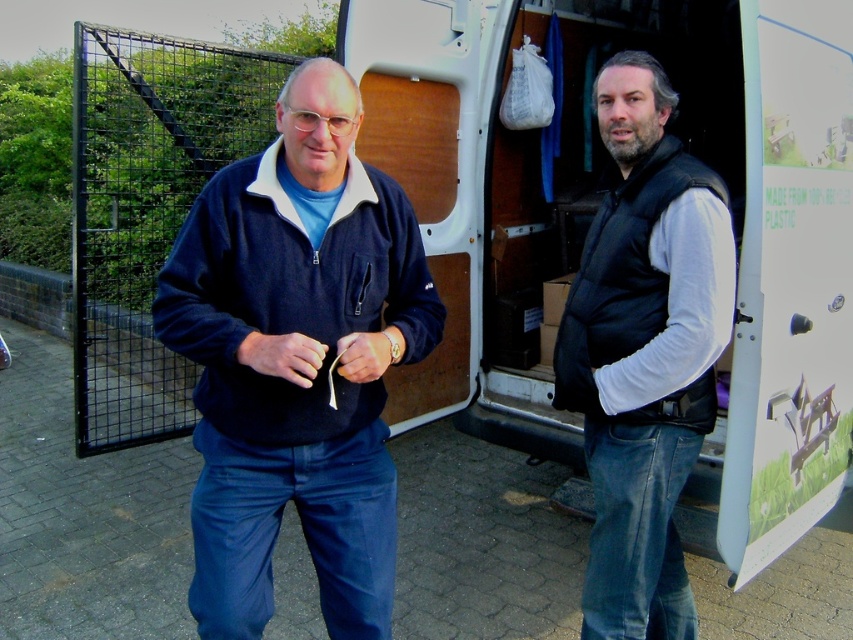
At what (x,y) coordinates should I click in order to perform the action: click on white plastic van at center. Please return your answer as a coordinate pair (x, y). Image resolution: width=853 pixels, height=640 pixels. Looking at the image, I should click on (593, 211).

Is white plastic van at center to the right of navy fleece jacket at center from the viewer's perspective?

Yes, white plastic van at center is to the right of navy fleece jacket at center.

Which is in front, point (759, 253) or point (347, 464)?

Point (759, 253) is in front.

Find the location of a particular element. Image resolution: width=853 pixels, height=640 pixels. white plastic van at center is located at coordinates (593, 211).

Is navy fleece jacket at center taller than black matte vest at center?

Incorrect, navy fleece jacket at center's height is not larger of black matte vest at center's.

Is point (329, 554) positioned in front of point (616, 332)?

That is True.

Locate an element on the screen. The height and width of the screenshot is (640, 853). navy fleece jacket at center is located at coordinates (297, 362).

Locate an element on the screen. The image size is (853, 640). navy fleece jacket at center is located at coordinates (297, 362).

Can you confirm if white plastic van at center is taller than black matte vest at center?

Correct, white plastic van at center is much taller as black matte vest at center.

Measure the distance from white plastic van at center to black matte vest at center.

The distance of white plastic van at center from black matte vest at center is 1.22 meters.

Describe the element at coordinates (593, 211) in the screenshot. Image resolution: width=853 pixels, height=640 pixels. I see `white plastic van at center` at that location.

Locate an element on the screen. The image size is (853, 640). white plastic van at center is located at coordinates (593, 211).